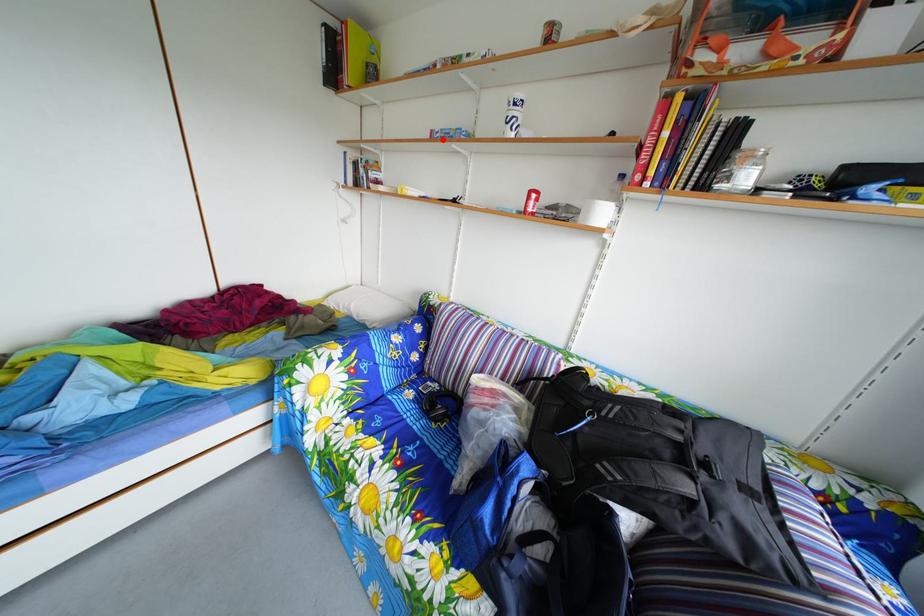
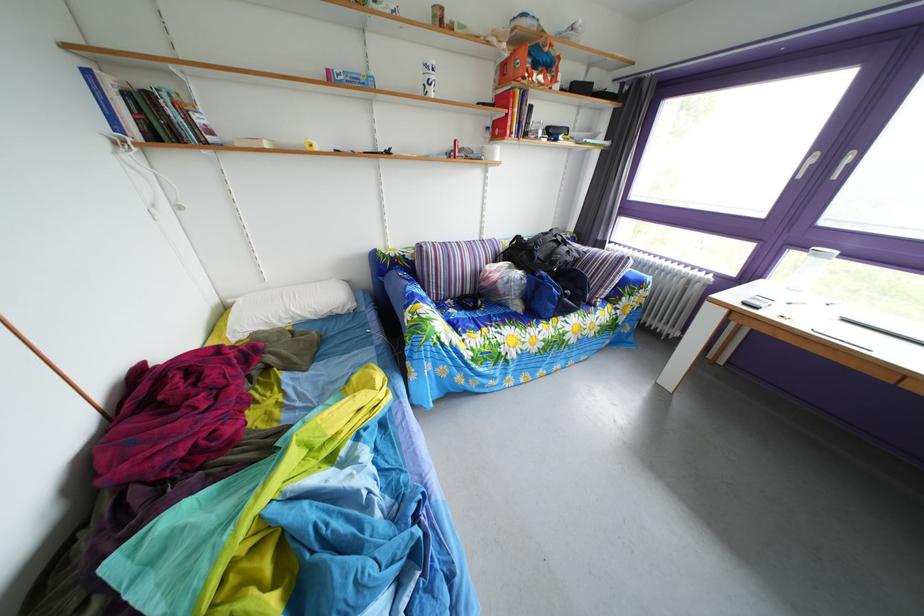
In the second image, find the point that corresponds to the highlighted location in the first image.

(339, 79)